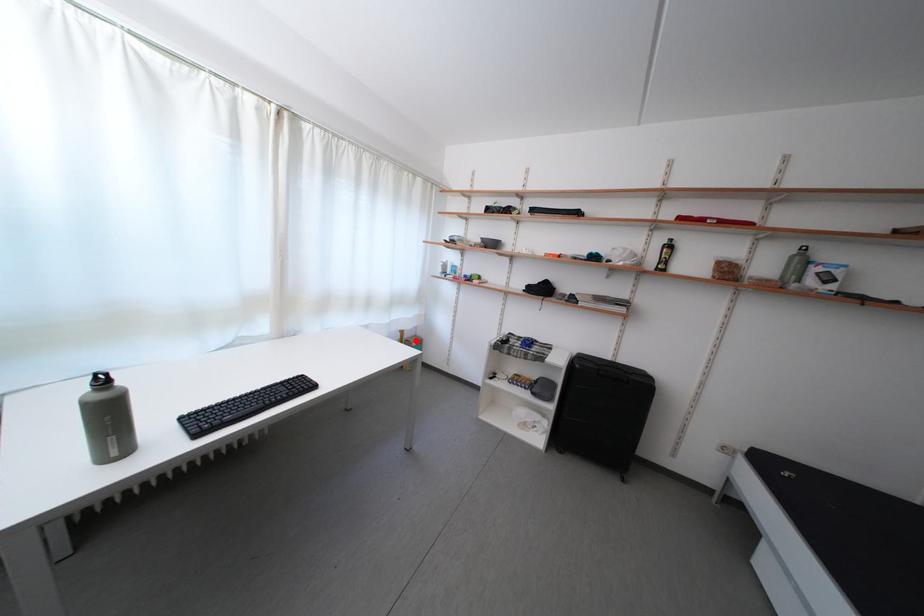
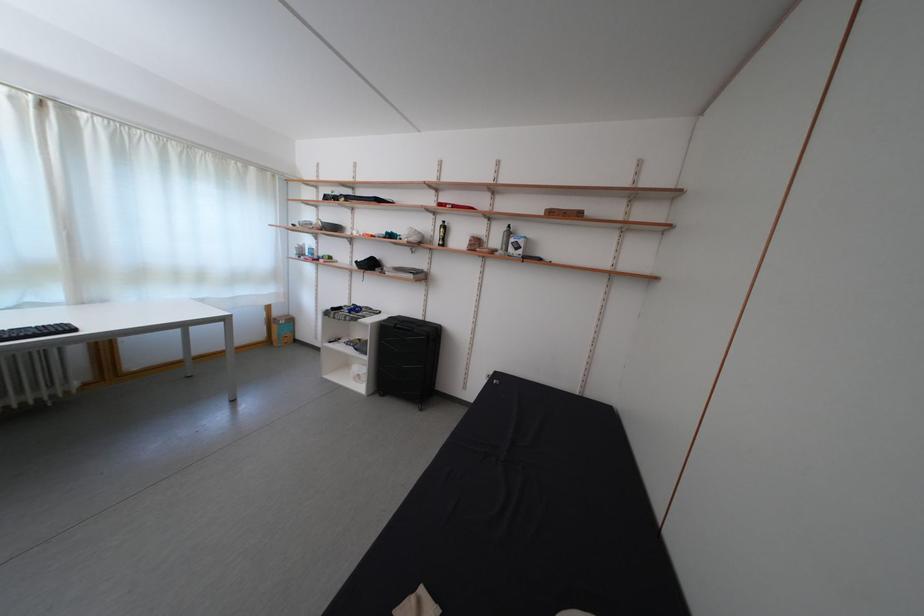
Question: I am providing you with two images of the same scene from different viewpoints. Image1 has a red point marked. In image2, the corresponding 3D location appears at what relative position? Reply with the corresponding letter.

Choices:
 (A) Closer
 (B) Farther

Answer: (B)